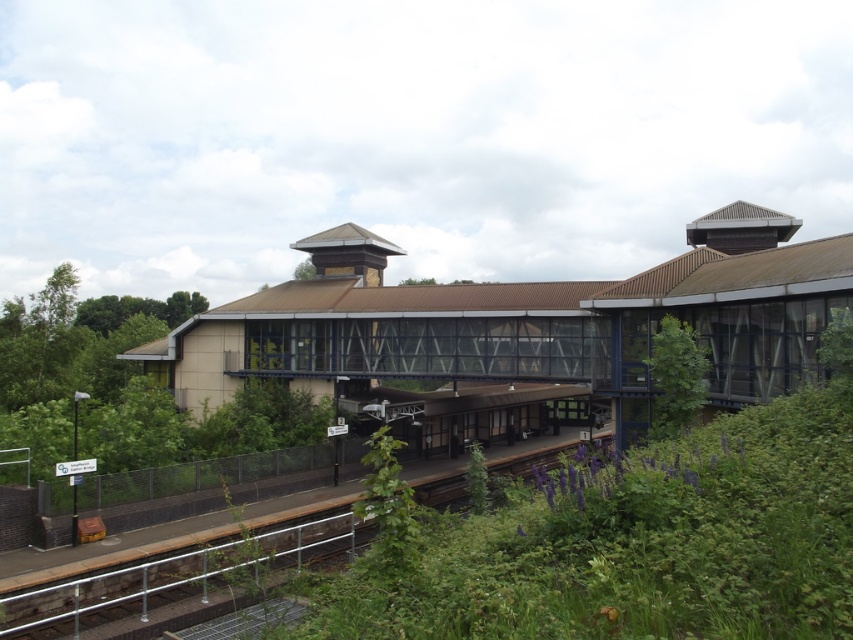
You are standing at the entrance of the train station and want to locate the brown textured building at center. According to the map, where is it positioned in 2D coordinates?

The brown textured building at center is located at the 2D coordinates point (525, 321).

You are a passenger standing at the entrance of the train station and want to reach the metallic rail at lower center. Which direction should you move relative to the brown textured building at center?

You should move behind the brown textured building at center to reach the metallic rail at lower center since the metallic rail at lower center is located behind the brown textured building at center.